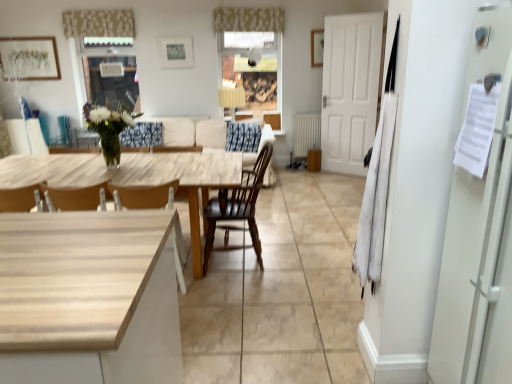
This screenshot has width=512, height=384. What are the coordinates of `free space on the front side of dark brown wood chair at center, which is counted as the first chair, starting from the right` in the screenshot? It's located at (240, 293).